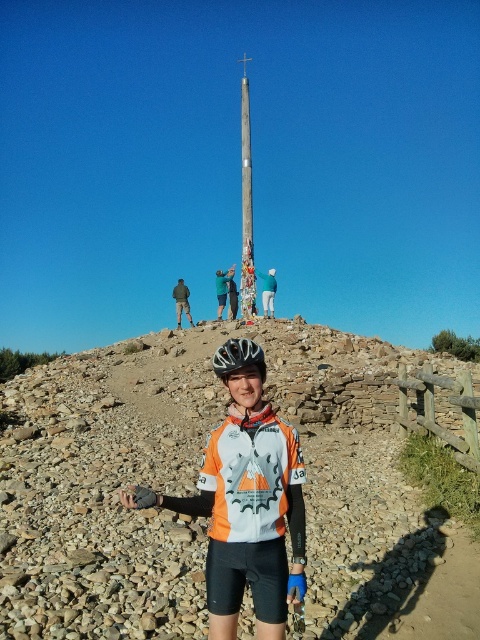
Question: Does orange jersey at center appear on the right side of wooden pole at center?

Choices:
 (A) yes
 (B) no

Answer: (A)

Question: Does orange jersey at center appear on the left side of wooden pole at center?

Choices:
 (A) yes
 (B) no

Answer: (B)

Question: Which object appears farthest from the camera in this image?

Choices:
 (A) rough stone hillside at center
 (B) wooden pole at center
 (C) matte black helmet at center

Answer: (B)

Question: Is rough stone hillside at center positioned behind orange jersey at center?

Choices:
 (A) yes
 (B) no

Answer: (A)

Question: Which of the following is the closest to the observer?

Choices:
 (A) (228, 378)
 (B) (383, 444)
 (C) (186, 310)
 (D) (244, 228)

Answer: (A)

Question: Which point is farther to the camera?

Choices:
 (A) (181, 310)
 (B) (119, 621)
 (C) (248, 88)

Answer: (C)